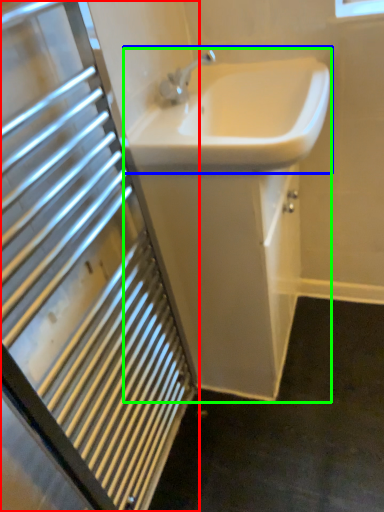
Question: Which is nearer to the bathroom cabinet (highlighted by a red box)? sink (highlighted by a blue box) or sink (highlighted by a green box).

Choices:
 (A) sink
 (B) sink

Answer: (B)